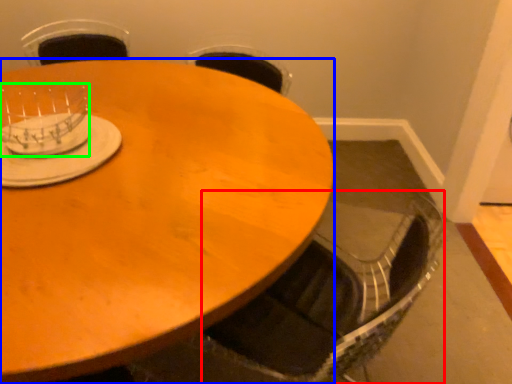
Question: Considering the real-world distances, which object is farthest from swivel chair (highlighted by a red box)? coffee table (highlighted by a blue box) or tableware (highlighted by a green box)?

Choices:
 (A) coffee table
 (B) tableware

Answer: (B)